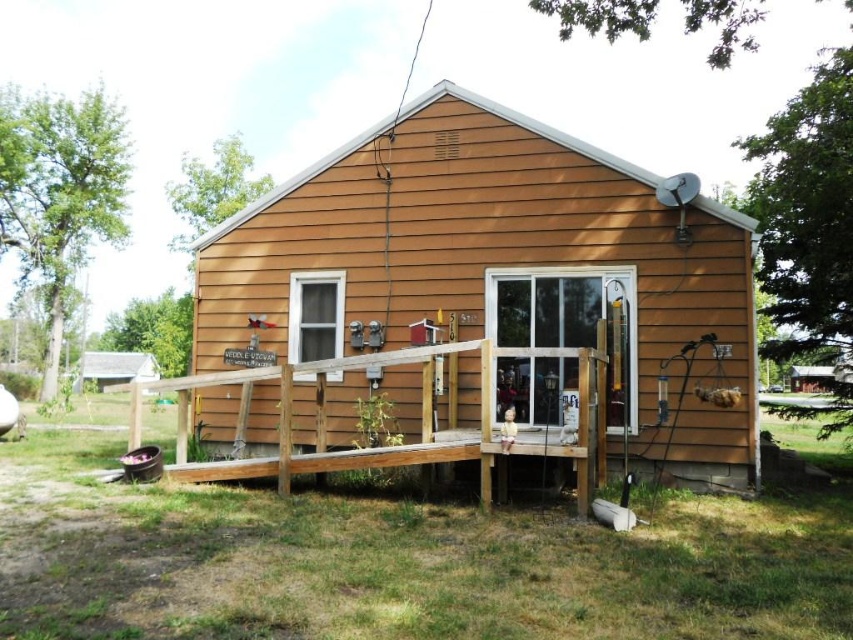
Question: Considering the relative positions of brown wood siding at center and brown wooden porch at center in the image provided, where is brown wood siding at center located with respect to brown wooden porch at center?

Choices:
 (A) below
 (B) above

Answer: (A)

Question: Considering the relative positions of brown wood siding at center and brown wooden porch at center in the image provided, where is brown wood siding at center located with respect to brown wooden porch at center?

Choices:
 (A) below
 (B) above

Answer: (A)

Question: Which of the following is the closest to the observer?

Choices:
 (A) brown wood siding at center
 (B) brown wooden porch at center

Answer: (B)

Question: Does brown wood siding at center appear on the left side of brown wooden porch at center?

Choices:
 (A) no
 (B) yes

Answer: (A)